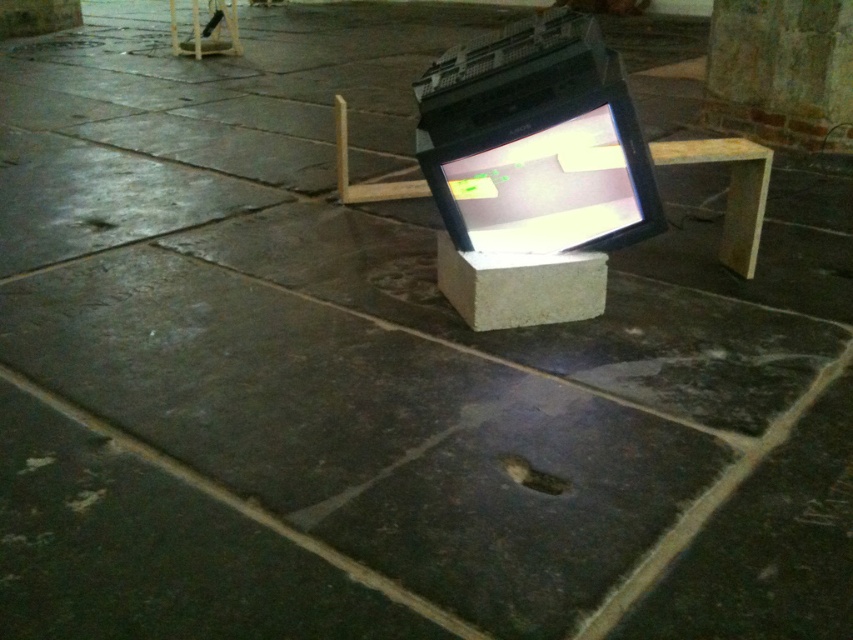
You are standing in the room and want to place a small object on the floor. You have two options for placement based on the coordinates given in the scene. Which coordinate point, point (566, 195) or point (683, 161), is closer to you where you are standing?

Point (566, 195) is closer to the viewer than point (683, 161), so you should place the object there if you want it nearer to your current position.

You are standing in the room and want to place a new decorative item between the matte black monitor at center and the wooden at center. Based on their positions, which object should you place the item closer to if you want it to be nearer to the left side of the room?

You should place the decorative item closer to the wooden at center because the matte black monitor at center is to the left of the wooden at center, meaning the wooden at center is to the right. Therefore, placing it near the wooden at center would position it closer to the right side, but if you want it nearer to the left side, you should place it closer to the matte black monitor at center.